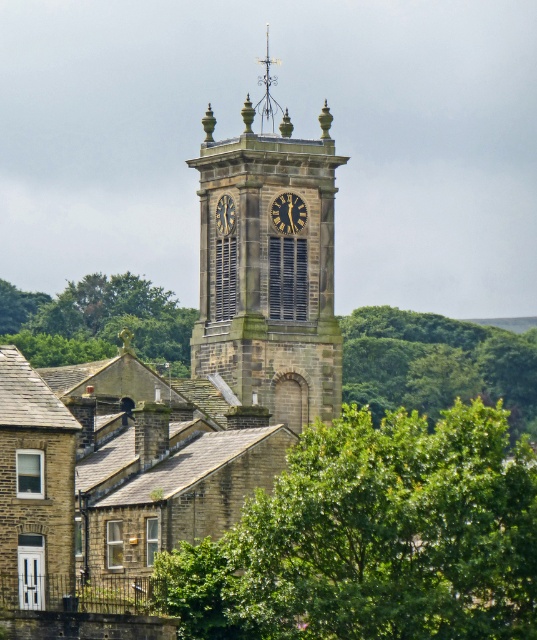
You are standing in front of the stone clock tower at center and want to find the green leafy tree at left. In which direction should you turn to see it?

The green leafy tree at left is to the left of the stone clock tower at center, so you should turn to your left to see it.

Consider the image. You are standing in front of the stone clock tower at center and want to take a photo of the green leafy tree at left. Since the tree is behind the tower, will it be visible in the photo?

The stone clock tower at center is closer to the viewer than the green leafy tree at left, so the tree will be partially or fully blocked by the tower in the photo.

You are standing in front of the clock tower and see two points marked on the ground. The first point is at coordinates point (484, 625) and the second point is at point (217, 212). Which point is closer to you?

Point (484, 625) is in front of point (217, 212), so it is closer to you.